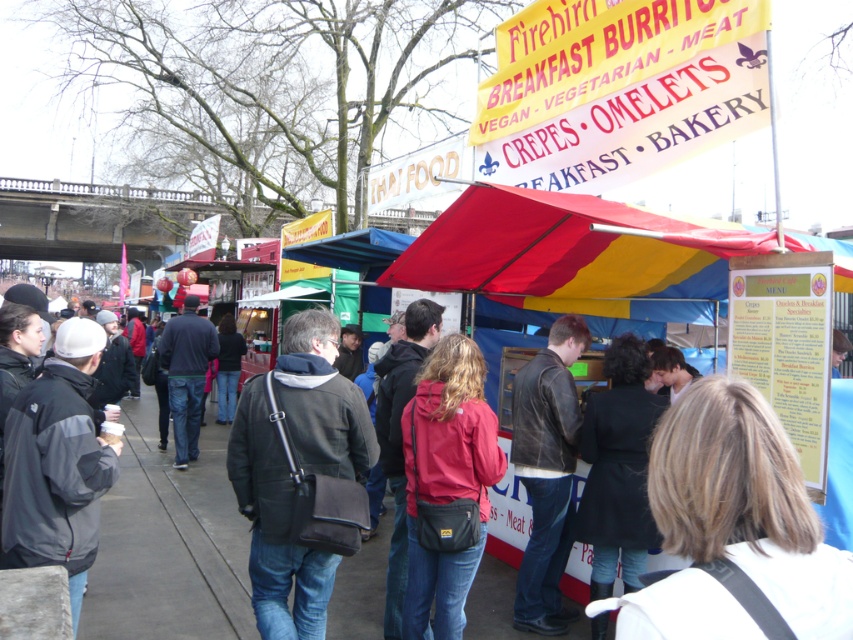
Can you confirm if leather jacket at center is shorter than dark blue jacket at center?

Yes.

What do you see at coordinates (547, 472) in the screenshot?
I see `leather jacket at center` at bounding box center [547, 472].

Image resolution: width=853 pixels, height=640 pixels. Find the location of `leather jacket at center`. leather jacket at center is located at coordinates (547, 472).

Can you confirm if blonde hair at center is bigger than leather jacket at center?

No.

Does blonde hair at center have a lesser width compared to leather jacket at center?

Correct, blonde hair at center's width is less than leather jacket at center's.

Does point (682, 474) lie behind point (523, 554)?

No.

In order to click on blonde hair at center in this screenshot , I will do `click(746, 502)`.

Which is in front, point (426, 412) or point (534, 387)?

Point (426, 412)

Can you confirm if matte red jacket at center is taller than leather jacket at center?

Incorrect, matte red jacket at center's height is not larger of leather jacket at center's.

Where is `matte red jacket at center`? The height and width of the screenshot is (640, 853). matte red jacket at center is located at coordinates (445, 481).